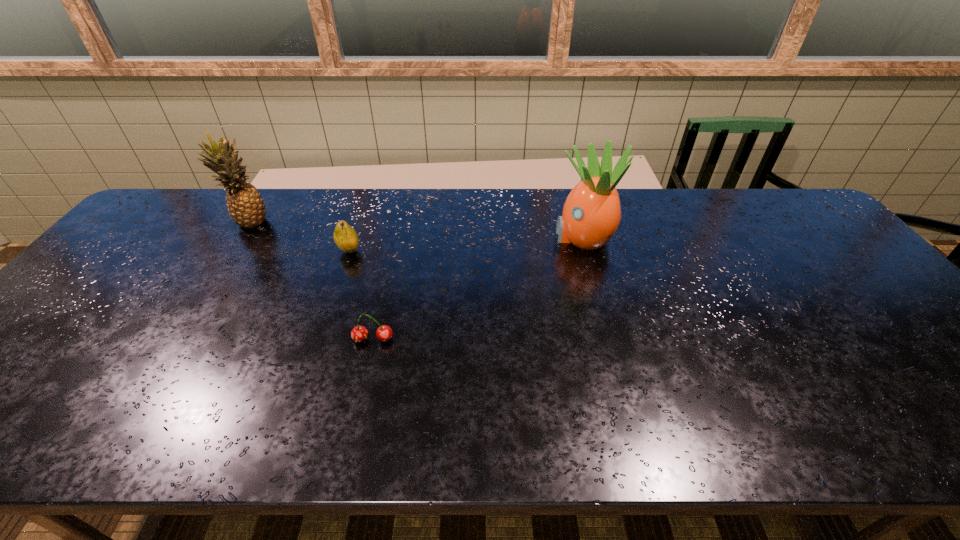
Find the location of a particular element. The height and width of the screenshot is (540, 960). free spot that satisfies the following two spatial constraints: 1. at the entrance of the right pineapple; 2. on the front side of the second object from left to right is located at coordinates (587, 251).

Locate an element on the screen. The height and width of the screenshot is (540, 960). blank area in the image that satisfies the following two spatial constraints: 1. at the entrance of the rightmost object; 2. with stems pointing upwards on the cherry is located at coordinates (611, 340).

The width and height of the screenshot is (960, 540). I want to click on free spot that satisfies the following two spatial constraints: 1. at the entrance of the right pineapple; 2. with stems pointing upwards on the nearest object, so (611, 340).

You are a GUI agent. You are given a task and a screenshot of the screen. Output one action in this format:
    pyautogui.click(x=<x>, y=<y>)
    Task: Click on the vacant space that satisfies the following two spatial constraints: 1. at the entrance of the right pineapple; 2. with stems pointing upwards on the third object from left to right
    
    Given the screenshot: What is the action you would take?
    tap(611, 340)